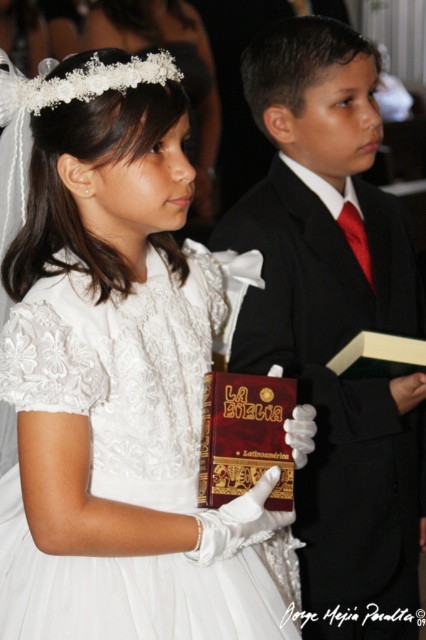
Is white lace dress at center thinner than dark red leather bible at center?

No.

Does white lace dress at center appear on the right side of dark red leather bible at center?

In fact, white lace dress at center is to the left of dark red leather bible at center.

Where is `white lace dress at center`? white lace dress at center is located at coordinates (118, 381).

Does white lace dress at center appear over shiny black suit at center?

Incorrect, white lace dress at center is not positioned above shiny black suit at center.

From the picture: Who is lower down, white lace dress at center or shiny black suit at center?

white lace dress at center

Looking at this image, measure the distance between point (169, 458) and camera.

Point (169, 458) is 4.48 feet from camera.

Where is `white lace dress at center`? white lace dress at center is located at coordinates (118, 381).

Is shiny black suit at center thinner than dark red leather bible at center?

No, shiny black suit at center is not thinner than dark red leather bible at center.

What do you see at coordinates (334, 321) in the screenshot?
I see `shiny black suit at center` at bounding box center [334, 321].

Is point (331, 449) positioned behind point (261, 410)?

Yes, it is.

I want to click on shiny black suit at center, so click(334, 321).